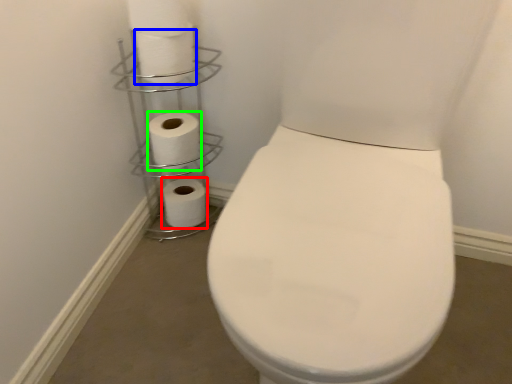
Question: Based on their relative distances, which object is farther from toilet paper (highlighted by a red box)? Choose from toilet paper (highlighted by a blue box) and toilet paper (highlighted by a green box).

Choices:
 (A) toilet paper
 (B) toilet paper

Answer: (A)